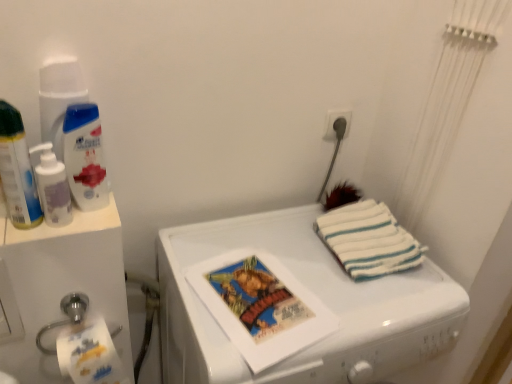
What do you see at coordinates (85, 156) in the screenshot? I see `white glossy shampoo at upper left, which is the first cleaning product in right-to-left order` at bounding box center [85, 156].

Consider the image. Measure the distance between point [42,162] and camera.

29.88 inches.

Find the location of a particular element. white glossy washing machine at center is located at coordinates (312, 291).

The height and width of the screenshot is (384, 512). Find the location of `white plastic water cooler at left`. white plastic water cooler at left is located at coordinates tap(61, 285).

The height and width of the screenshot is (384, 512). Describe the element at coordinates (61, 285) in the screenshot. I see `white plastic water cooler at left` at that location.

Identify the location of matte plastic spray can at left. (17, 170).

What are the coordinates of `white plastic socket at upper right` in the screenshot? It's located at (335, 121).

Does point (320, 228) come closer to viewer compared to point (341, 113)?

Yes, it is.

Considering the positions of objects white striped towel at right and white plastic socket at upper right in the image provided, who is more to the left, white striped towel at right or white plastic socket at upper right?

white plastic socket at upper right is more to the left.

What's the angular difference between white striped towel at right and white plastic socket at upper right's facing directions?

The angular difference between white striped towel at right and white plastic socket at upper right is 1.17 degrees.

From the image's perspective, is white striped towel at right on white plastic socket at upper right?

Actually, white striped towel at right appears below white plastic socket at upper right in the image.

Is white glossy shampoo at upper left, which is the first cleaning product in right-to-left order, taller than matte plastic spray can at left?

Incorrect, the height of white glossy shampoo at upper left, which is the first cleaning product in right-to-left order, is not larger of that of matte plastic spray can at left.

Does point (99, 187) appear closer or farther from the camera than point (11, 143)?

Point (99, 187) is positioned farther from the camera compared to point (11, 143).

Considering the relative positions of white glossy shampoo at upper left, which is the first cleaning product in right-to-left order, and matte plastic spray can at left in the image provided, is white glossy shampoo at upper left, which is the first cleaning product in right-to-left order, to the right of matte plastic spray can at left from the viewer's perspective?

Yes, white glossy shampoo at upper left, which is the first cleaning product in right-to-left order, is to the right of matte plastic spray can at left.

Could you measure the distance between white glossy shampoo at upper left, acting as the 2th cleaning product starting from the left, and matte plastic spray can at left?

3.75 inches.

Considering the sizes of white plastic socket at upper right and white striped towel at right in the image, is white plastic socket at upper right wider or thinner than white striped towel at right?

Clearly, white plastic socket at upper right has less width compared to white striped towel at right.

Are white plastic socket at upper right and white striped towel at right beside each other?

No, white plastic socket at upper right is not making contact with white striped towel at right.

Considering the sizes of white plastic socket at upper right and white striped towel at right in the image, is white plastic socket at upper right bigger or smaller than white striped towel at right?

In the image, white plastic socket at upper right appears to be smaller than white striped towel at right.

Is translucent plastic pump bottle at left, the 2th cleaning product in the right-to-left sequence, not close to white plastic socket at upper right?

No, translucent plastic pump bottle at left, the 2th cleaning product in the right-to-left sequence, is not far from white plastic socket at upper right.

From the picture: Visually, is translucent plastic pump bottle at left, the 2th cleaning product in the right-to-left sequence, positioned to the left or to the right of white plastic socket at upper right?

Based on their positions, translucent plastic pump bottle at left, the 2th cleaning product in the right-to-left sequence, is located to the left of white plastic socket at upper right.

Considering the relative sizes of translucent plastic pump bottle at left, the 2th cleaning product in the right-to-left sequence, and white plastic socket at upper right in the image provided, is translucent plastic pump bottle at left, the 2th cleaning product in the right-to-left sequence, taller than white plastic socket at upper right?

Yes, translucent plastic pump bottle at left, the 2th cleaning product in the right-to-left sequence, is taller than white plastic socket at upper right.

From a real-world perspective, is translucent plastic pump bottle at left, the 2th cleaning product in the right-to-left sequence, located higher than white plastic socket at upper right?

No, from a real-world perspective, translucent plastic pump bottle at left, the 2th cleaning product in the right-to-left sequence, is not above white plastic socket at upper right.

Who is smaller, white glossy washing machine at center or translucent plastic pump bottle at left, the 2th cleaning product in the right-to-left sequence?

translucent plastic pump bottle at left, the 2th cleaning product in the right-to-left sequence.

In the scene shown: How many degrees apart are the facing directions of white glossy washing machine at center and translucent plastic pump bottle at left, the 2th cleaning product in the right-to-left sequence?

The facing directions of white glossy washing machine at center and translucent plastic pump bottle at left, the 2th cleaning product in the right-to-left sequence, are 0.59 degrees apart.

Considering the positions of objects white glossy washing machine at center and translucent plastic pump bottle at left, arranged as the first cleaning product when viewed from the left, in the image provided, who is more to the left, white glossy washing machine at center or translucent plastic pump bottle at left, arranged as the first cleaning product when viewed from the left,?

Positioned to the left is translucent plastic pump bottle at left, arranged as the first cleaning product when viewed from the left.

Does white glossy washing machine at center have a lesser height compared to translucent plastic pump bottle at left, arranged as the first cleaning product when viewed from the left?

No, white glossy washing machine at center is not shorter than translucent plastic pump bottle at left, arranged as the first cleaning product when viewed from the left.

Is point (53, 226) more distant than point (250, 220)?

No, it is in front of (250, 220).

Could you tell me if translucent plastic pump bottle at left, the 2th cleaning product in the right-to-left sequence, is turned towards white glossy washing machine at center?

No, translucent plastic pump bottle at left, the 2th cleaning product in the right-to-left sequence, is not aimed at white glossy washing machine at center.

From a real-world perspective, who is located lower, translucent plastic pump bottle at left, arranged as the first cleaning product when viewed from the left, or white glossy washing machine at center?

white glossy washing machine at center, from a real-world perspective.

Considering the positions of points (102, 310) and (31, 189), is point (102, 310) closer to camera compared to point (31, 189)?

No, it is not.

Is white plastic water cooler at left at the left side of matte plastic spray can at left?

Correct, you'll find white plastic water cooler at left to the left of matte plastic spray can at left.

Does white plastic water cooler at left have a lesser height compared to matte plastic spray can at left?

No, white plastic water cooler at left is not shorter than matte plastic spray can at left.

From the image's perspective, which is below, white plastic water cooler at left or matte plastic spray can at left?

white plastic water cooler at left appears lower in the image.

The width and height of the screenshot is (512, 384). Identify the location of towel/napkin that appears below the white plastic socket at upper right (from a real-world perspective). (368, 240).

This screenshot has height=384, width=512. Identify the location of bottle that is above the white glossy shampoo at upper left, acting as the 2th cleaning product starting from the left (from a real-world perspective). (17, 170).

From the image, which object appears to be nearer to white plastic socket at upper right, white plastic water cooler at left or matte plastic spray can at left?

Among the two, matte plastic spray can at left is located nearer to white plastic socket at upper right.

Which object lies nearer to the anchor point matte plastic spray can at left, white plastic socket at upper right or white glossy shampoo at upper left, acting as the 2th cleaning product starting from the left?

Based on the image, white glossy shampoo at upper left, acting as the 2th cleaning product starting from the left, appears to be nearer to matte plastic spray can at left.

Which object lies nearer to the anchor point white glossy shampoo at upper left, acting as the 2th cleaning product starting from the left, matte plastic spray can at left or translucent plastic pump bottle at left, arranged as the first cleaning product when viewed from the left?

The object closer to white glossy shampoo at upper left, acting as the 2th cleaning product starting from the left, is translucent plastic pump bottle at left, arranged as the first cleaning product when viewed from the left.

When comparing their distances from white glossy shampoo at upper left, which is the first cleaning product in right-to-left order, does white glossy washing machine at center or matte plastic spray can at left seem further?

Based on the image, white glossy washing machine at center appears to be further to white glossy shampoo at upper left, which is the first cleaning product in right-to-left order.

Based on their spatial positions, is translucent plastic pump bottle at left, arranged as the first cleaning product when viewed from the left, or white glossy shampoo at upper left, which is the first cleaning product in right-to-left order, closer to white glossy washing machine at center?

Among the two, white glossy shampoo at upper left, which is the first cleaning product in right-to-left order, is located nearer to white glossy washing machine at center.

Looking at the image, which one is located further to white plastic water cooler at left, white plastic socket at upper right or matte plastic spray can at left?

white plastic socket at upper right is further to white plastic water cooler at left.

Based on their spatial positions, is white glossy shampoo at upper left, acting as the 2th cleaning product starting from the left, or translucent plastic pump bottle at left, arranged as the first cleaning product when viewed from the left, closer to white plastic water cooler at left?

translucent plastic pump bottle at left, arranged as the first cleaning product when viewed from the left, is closer to white plastic water cooler at left.

Based on their spatial positions, is white striped towel at right or white plastic socket at upper right further from white plastic water cooler at left?

white plastic socket at upper right is positioned further to the anchor white plastic water cooler at left.

Identify the location of cleaning product that lies between white glossy shampoo at upper left, acting as the 2th cleaning product starting from the left, and white glossy washing machine at center from top to bottom. This screenshot has height=384, width=512. (52, 187).

Where is `cleaning product situated between matte plastic spray can at left and white glossy shampoo at upper left, acting as the 2th cleaning product starting from the left, from left to right`? This screenshot has width=512, height=384. cleaning product situated between matte plastic spray can at left and white glossy shampoo at upper left, acting as the 2th cleaning product starting from the left, from left to right is located at coordinates (52, 187).

Locate an element on the screen. machine situated between white plastic water cooler at left and white striped towel at right from left to right is located at coordinates (312, 291).

You are a GUI agent. You are given a task and a screenshot of the screen. Output one action in this format:
    pyautogui.click(x=<x>, y=<y>)
    Task: Click on the bottle between white glossy shampoo at upper left, which is the first cleaning product in right-to-left order, and white glossy washing machine at center from top to bottom
    This screenshot has width=512, height=384.
    Given the screenshot: What is the action you would take?
    pyautogui.click(x=17, y=170)